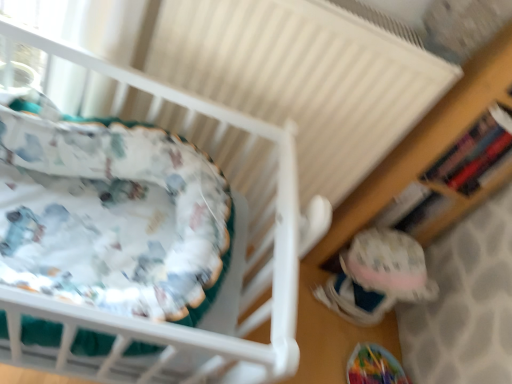
Question: Does white fabric infant bed at left have a larger size compared to fuzzy fabric toy at lower right?

Choices:
 (A) no
 (B) yes

Answer: (B)

Question: From the image's perspective, would you say white fabric infant bed at left is positioned over fuzzy fabric toy at lower right?

Choices:
 (A) no
 (B) yes

Answer: (B)

Question: Is white fabric infant bed at left to the left of fuzzy fabric toy at lower right from the viewer's perspective?

Choices:
 (A) no
 (B) yes

Answer: (B)

Question: Would you say white fabric infant bed at left contains fuzzy fabric toy at lower right?

Choices:
 (A) yes
 (B) no

Answer: (B)

Question: Considering the relative sizes of white fabric infant bed at left and fuzzy fabric toy at lower right in the image provided, is white fabric infant bed at left smaller than fuzzy fabric toy at lower right?

Choices:
 (A) no
 (B) yes

Answer: (A)

Question: From the image's perspective, is fuzzy fabric toy at lower right located above or below white fabric infant bed at left?

Choices:
 (A) above
 (B) below

Answer: (B)

Question: In terms of height, does fuzzy fabric toy at lower right look taller or shorter compared to white fabric infant bed at left?

Choices:
 (A) tall
 (B) short

Answer: (B)

Question: Is fuzzy fabric toy at lower right in front of or behind white fabric infant bed at left in the image?

Choices:
 (A) behind
 (B) front

Answer: (A)

Question: Considering the positions of fuzzy fabric toy at lower right and white fabric infant bed at left in the image, is fuzzy fabric toy at lower right bigger or smaller than white fabric infant bed at left?

Choices:
 (A) small
 (B) big

Answer: (A)

Question: From a real-world perspective, is white textured radiator at upper center above or below white fabric infant bed at left?

Choices:
 (A) below
 (B) above

Answer: (B)

Question: Would you say white textured radiator at upper center is to the left or to the right of white fabric infant bed at left in the picture?

Choices:
 (A) left
 (B) right

Answer: (B)

Question: From the image's perspective, is white textured radiator at upper center positioned above or below white fabric infant bed at left?

Choices:
 (A) above
 (B) below

Answer: (A)

Question: Looking at the image, does white textured radiator at upper center seem bigger or smaller compared to white fabric infant bed at left?

Choices:
 (A) small
 (B) big

Answer: (B)

Question: Would you say white fabric infant bed at left is inside or outside white textured radiator at upper center?

Choices:
 (A) inside
 (B) outside

Answer: (B)

Question: Considering their positions, is white fabric infant bed at left located in front of or behind white textured radiator at upper center?

Choices:
 (A) front
 (B) behind

Answer: (A)